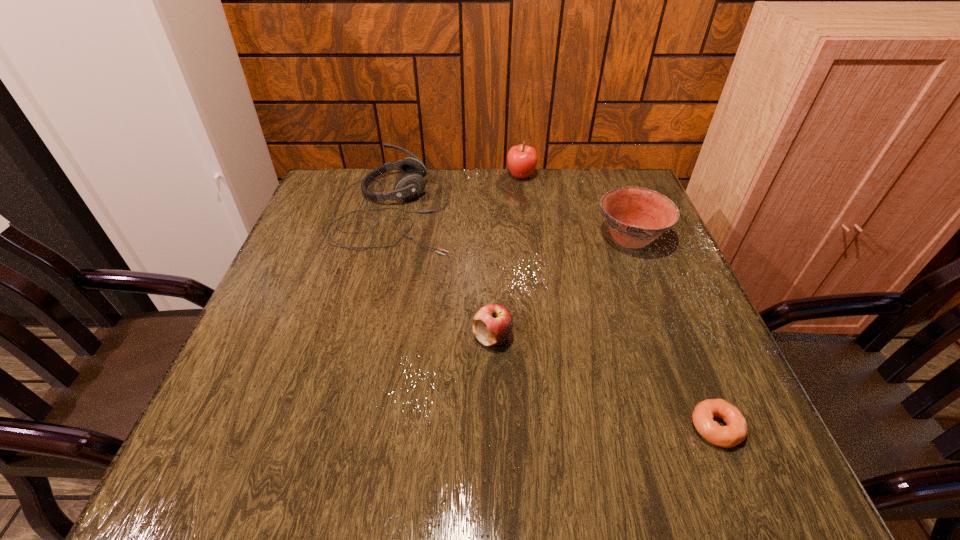
Locate an element on the screen. The image size is (960, 540). the closest object to the leftmost object is located at coordinates (521, 159).

You are a GUI agent. You are given a task and a screenshot of the screen. Output one action in this format:
    pyautogui.click(x=<x>, y=<y>)
    Task: Click on the vacant region that satisfies the following two spatial constraints: 1. on the outer surface of the headset; 2. on the back side of the bowl
    The width and height of the screenshot is (960, 540).
    Given the screenshot: What is the action you would take?
    pyautogui.click(x=387, y=238)

This screenshot has width=960, height=540. What are the coordinates of `vacant space that satisfies the following two spatial constraints: 1. on the front side of the left apple; 2. on the left side of the shortest object` in the screenshot? It's located at (494, 427).

Where is `free location that satisfies the following two spatial constraints: 1. on the outer surface of the headset; 2. on the right side of the bowl`? The width and height of the screenshot is (960, 540). free location that satisfies the following two spatial constraints: 1. on the outer surface of the headset; 2. on the right side of the bowl is located at coordinates (387, 238).

Locate an element on the screen. The width and height of the screenshot is (960, 540). free space that satisfies the following two spatial constraints: 1. on the outer surface of the headset; 2. on the right side of the bowl is located at coordinates (387, 238).

The height and width of the screenshot is (540, 960). In order to click on vacant space that satisfies the following two spatial constraints: 1. on the back side of the bowl; 2. on the left side of the left apple in this screenshot , I will do `click(490, 238)`.

Locate an element on the screen. This screenshot has width=960, height=540. vacant space that satisfies the following two spatial constraints: 1. on the outer surface of the bowl; 2. on the left side of the headset is located at coordinates (387, 238).

This screenshot has width=960, height=540. In order to click on vacant region that satisfies the following two spatial constraints: 1. on the front side of the nearest object; 2. on the left side of the bowl in this screenshot , I will do `click(704, 427)`.

The width and height of the screenshot is (960, 540). Identify the location of free point that satisfies the following two spatial constraints: 1. on the outer surface of the shortest object; 2. on the right side of the leftmost object. (341, 427).